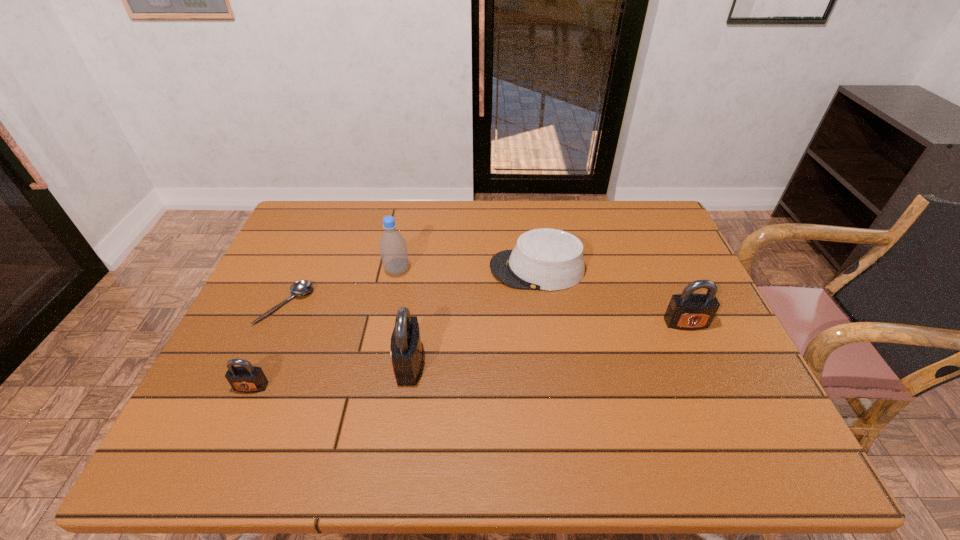
At what (x,y) coordinates should I click in order to perform the action: click on vacant space located on the front of the third tallest object near the keyhole. Please return your answer as a coordinate pair (x, y). This screenshot has height=540, width=960. Looking at the image, I should click on (714, 386).

Find the location of a particular element. vacant area situated 0.090m on the front-facing side of the second object from right to left is located at coordinates (459, 269).

Image resolution: width=960 pixels, height=540 pixels. Find the location of `vacant region located 0.090m on the front-facing side of the second object from right to left`. vacant region located 0.090m on the front-facing side of the second object from right to left is located at coordinates (459, 269).

Find the location of a particular element. This screenshot has width=960, height=540. free space located on the front-facing side of the second object from right to left is located at coordinates (468, 269).

Locate an element on the screen. The image size is (960, 540). vacant position located on the left of the third object from left to right is located at coordinates (288, 270).

This screenshot has height=540, width=960. I want to click on free space located 0.180m on the front of the shortest object, so pyautogui.click(x=250, y=387).

Where is `padlock positioned at the left edge`? The height and width of the screenshot is (540, 960). padlock positioned at the left edge is located at coordinates (246, 378).

This screenshot has height=540, width=960. I want to click on ladle situated at the left edge, so click(299, 288).

This screenshot has height=540, width=960. I want to click on object that is at the right edge, so click(x=689, y=311).

Locate an element on the screen. This screenshot has width=960, height=540. object that is positioned at the near left corner is located at coordinates (246, 378).